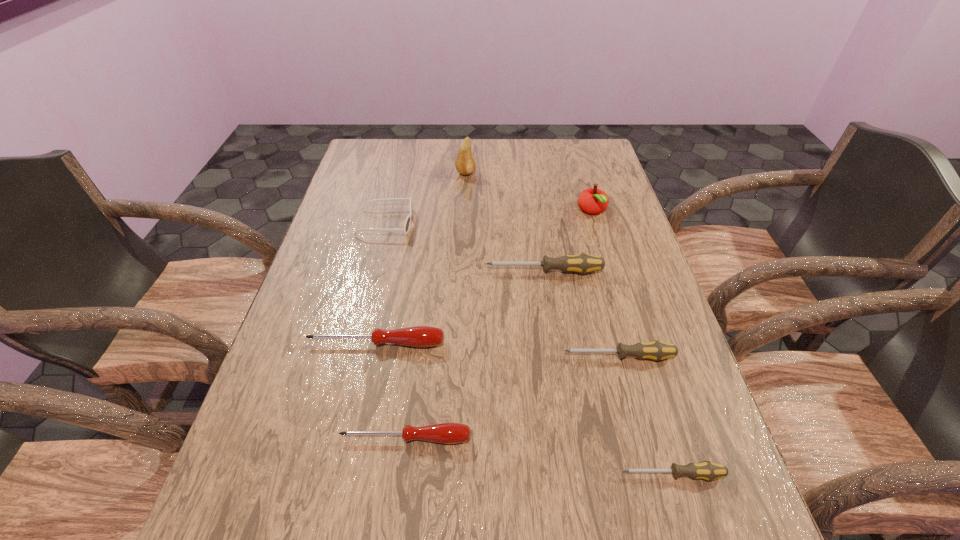
The image size is (960, 540). Find the location of `apple situated at the right edge`. apple situated at the right edge is located at coordinates (592, 200).

I want to click on blank area at the far edge, so click(487, 164).

Where is `free location at the left edge`? free location at the left edge is located at coordinates [x=351, y=272].

In the image, there is a desktop. Where is `free space at the right edge`? free space at the right edge is located at coordinates (649, 272).

You are a GUI agent. You are given a task and a screenshot of the screen. Output one action in this format:
    pyautogui.click(x=<x>, y=<y>)
    Task: Click on the vacant area that lies between the shortest object and the pear
    The image size is (960, 540).
    Given the screenshot: What is the action you would take?
    pyautogui.click(x=569, y=324)

Locate an element on the screen. The height and width of the screenshot is (540, 960). vacant area between the nearest screwdriver and the tallest object is located at coordinates (569, 324).

Where is `vacant space in between the black sunglasses and the nearest object`? vacant space in between the black sunglasses and the nearest object is located at coordinates (529, 349).

Find the location of `free space between the seventh shortest object and the seventh farthest object`. free space between the seventh shortest object and the seventh farthest object is located at coordinates (499, 325).

What are the coordinates of `free space between the sunglasses and the nearest screwdriver` in the screenshot? It's located at (529, 349).

Where is `free space between the seventh shortest object and the farther red screwdriver`? The height and width of the screenshot is (540, 960). free space between the seventh shortest object and the farther red screwdriver is located at coordinates (484, 277).